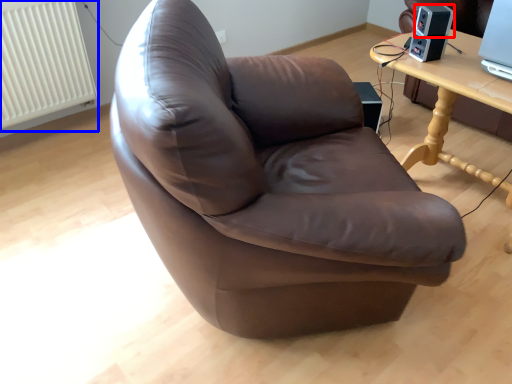
Question: Which point is closer to the camera, speaker (highlighted by a red box) or radiator (highlighted by a blue box)?

Choices:
 (A) speaker
 (B) radiator

Answer: (A)